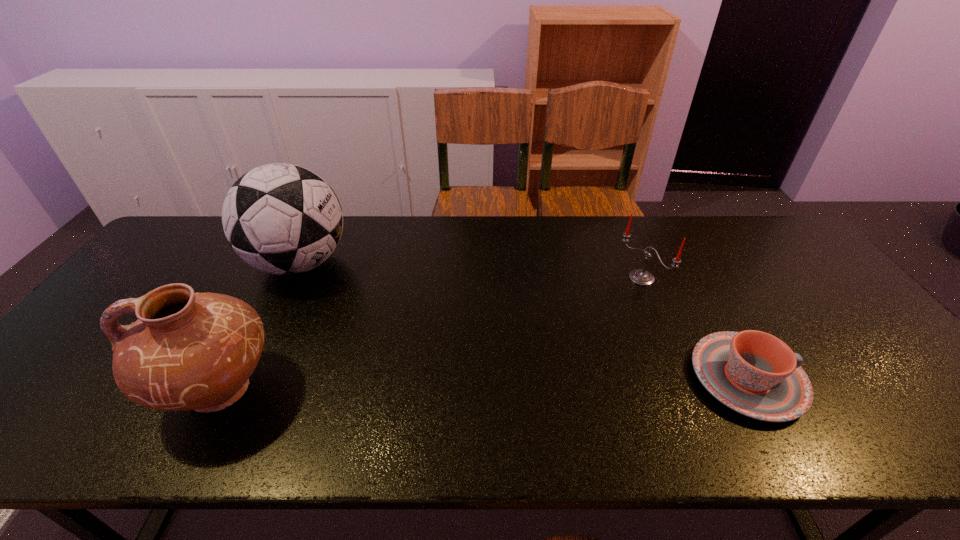
The height and width of the screenshot is (540, 960). Find the location of `vacant area situated on the surface of the soccer ball where the brand logo is visible`. vacant area situated on the surface of the soccer ball where the brand logo is visible is located at coordinates (355, 308).

Identify the location of vacant space located on the front-facing side of the candle. This screenshot has height=540, width=960. (591, 320).

The height and width of the screenshot is (540, 960). Find the location of `vacant space situated 0.260m on the front-facing side of the candle`. vacant space situated 0.260m on the front-facing side of the candle is located at coordinates (573, 335).

At what (x,y) coordinates should I click in order to perform the action: click on free space located on the front-facing side of the candle. Please return your answer as a coordinate pair (x, y). Image resolution: width=960 pixels, height=540 pixels. Looking at the image, I should click on (610, 305).

At what (x,y) coordinates should I click in order to perform the action: click on object that is at the far edge. Please return your answer as a coordinate pair (x, y). Looking at the image, I should click on (284, 219).

Where is `pottery situated at the near edge`? This screenshot has width=960, height=540. pottery situated at the near edge is located at coordinates (187, 351).

The width and height of the screenshot is (960, 540). Find the location of `chinaware at the near edge`. chinaware at the near edge is located at coordinates (756, 374).

At what (x,y) coordinates should I click in order to perform the action: click on vacant space at the far edge of the desktop. Please return your answer as a coordinate pair (x, y). The image size is (960, 540). Looking at the image, I should click on (654, 247).

At what (x,y) coordinates should I click in order to perform the action: click on free region at the near edge of the desktop. Please return your answer as a coordinate pair (x, y). The width and height of the screenshot is (960, 540). Looking at the image, I should click on (628, 388).

Find the location of a particular element. free region at the left edge is located at coordinates (161, 261).